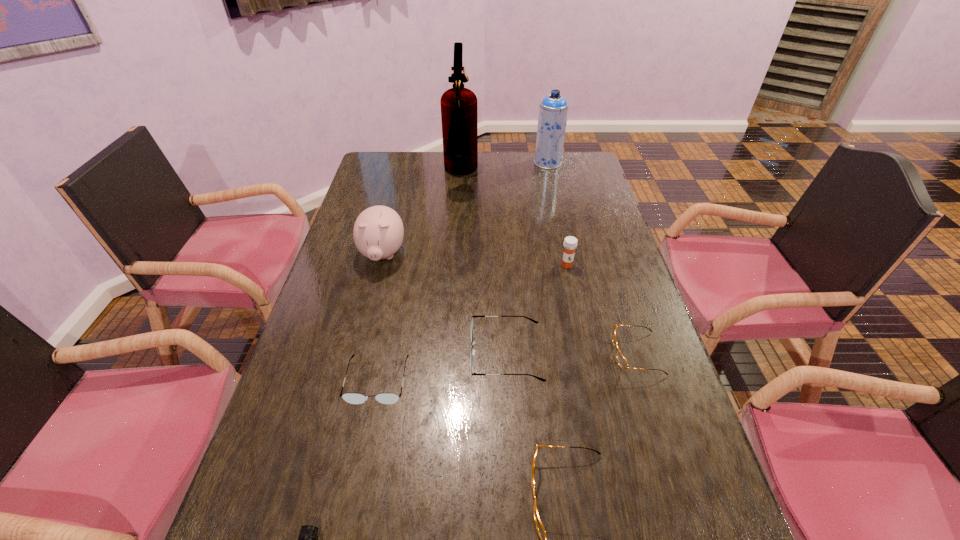
Image resolution: width=960 pixels, height=540 pixels. I want to click on vacant area situated 0.220m on the front-facing side of the smaller gold spectacles, so click(525, 354).

Where is `free point located on the front-facing side of the smaller gold spectacles`? Image resolution: width=960 pixels, height=540 pixels. free point located on the front-facing side of the smaller gold spectacles is located at coordinates (558, 354).

The width and height of the screenshot is (960, 540). I want to click on fire extinguisher situated at the far edge, so click(x=459, y=115).

You are a GUI agent. You are given a task and a screenshot of the screen. Output one action in this format:
    pyautogui.click(x=<x>, y=<y>)
    Task: Click on the aerosol can at the far edge
    Image resolution: width=960 pixels, height=540 pixels.
    Given the screenshot: What is the action you would take?
    pyautogui.click(x=553, y=110)

The image size is (960, 540). I want to click on piggy bank at the left edge, so click(378, 232).

Locate an element on the screen. The width and height of the screenshot is (960, 540). spectacles that is at the left edge is located at coordinates click(353, 398).

Find the location of a particular element. The height and width of the screenshot is (540, 960). aerosol can at the right edge is located at coordinates (553, 110).

Where is `spectacles that is at the right edge`? spectacles that is at the right edge is located at coordinates (622, 361).

Find the location of a particular element. The width and height of the screenshot is (960, 540). object that is positioned at the far right corner is located at coordinates point(553,110).

Locate an element on the screen. vacant space at the left edge is located at coordinates (352, 269).